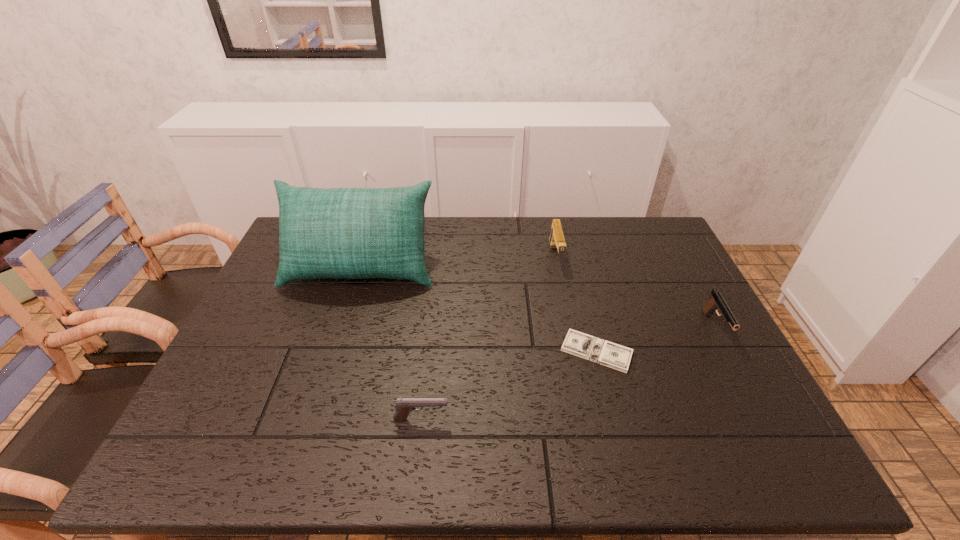
Identify the location of blank space at the left edge. Image resolution: width=960 pixels, height=540 pixels. (274, 284).

The height and width of the screenshot is (540, 960). Identify the location of vacant space at the right edge of the desktop. (703, 429).

You are a GUI agent. You are given a task and a screenshot of the screen. Output one action in this format:
    pyautogui.click(x=<x>, y=<y>)
    Task: Click on the free location at the far right corner of the desktop
    
    Given the screenshot: What is the action you would take?
    pyautogui.click(x=627, y=227)

This screenshot has height=540, width=960. In order to click on free space that is in between the nearest pistol and the tallest pistol in this screenshot , I will do `click(489, 338)`.

Locate an element on the screen. The width and height of the screenshot is (960, 540). blank region between the tallest object and the rightmost pistol is located at coordinates (538, 298).

I want to click on empty space between the second pistol from left to right and the cushion, so click(458, 262).

At what (x,y) coordinates should I click in order to perform the action: click on vacant space that's between the tallest object and the leftmost pistol. Please return your answer as a coordinate pair (x, y). Image resolution: width=960 pixels, height=540 pixels. Looking at the image, I should click on (391, 343).

The width and height of the screenshot is (960, 540). What are the coordinates of `vacant space that's between the rightmost pistol and the dollar` in the screenshot? It's located at (656, 340).

This screenshot has height=540, width=960. I want to click on vacant area between the tallest pistol and the nearest object, so click(489, 338).

At what (x,y) coordinates should I click in order to perform the action: click on free space between the dollar and the tallest pistol. Please return your answer as a coordinate pair (x, y). Looking at the image, I should click on (576, 304).